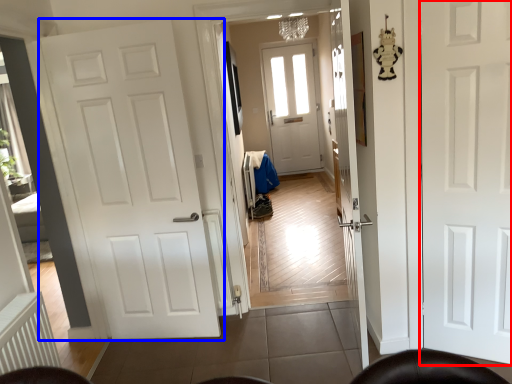
Question: Which object appears closest to the camera in this image, door (highlighted by a red box) or door (highlighted by a blue box)?

Choices:
 (A) door
 (B) door

Answer: (A)